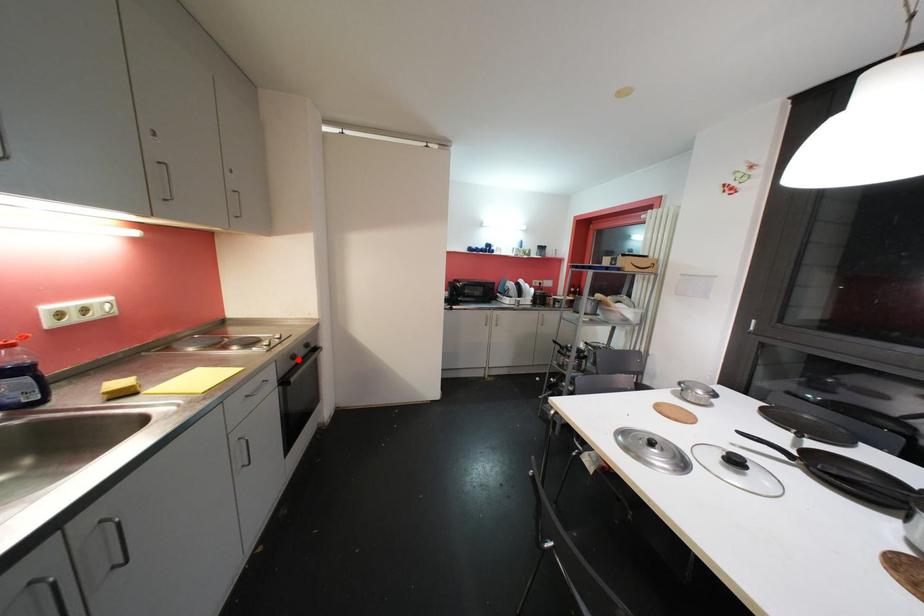
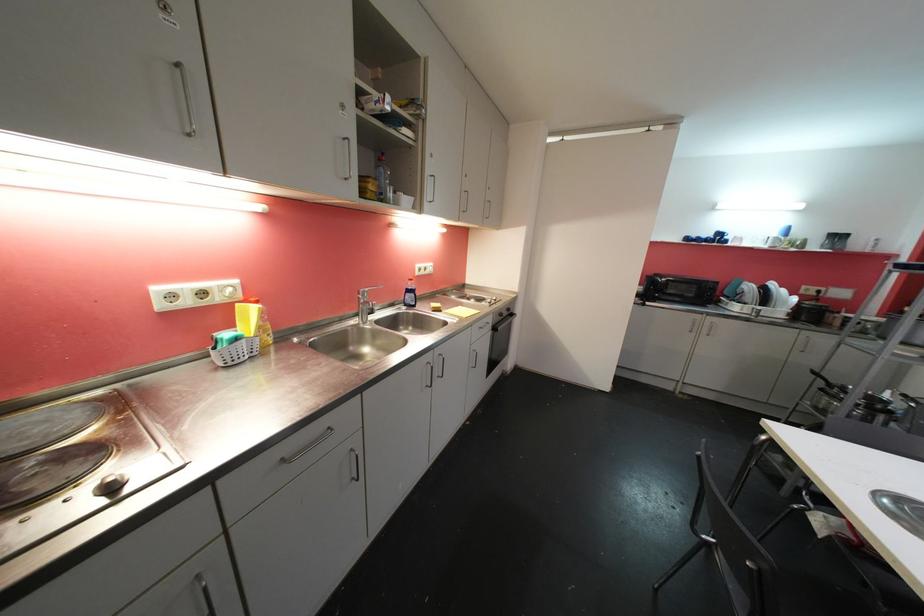
Locate, in the second image, the point that corresponds to the highlighted location in the first image.

(505, 317)